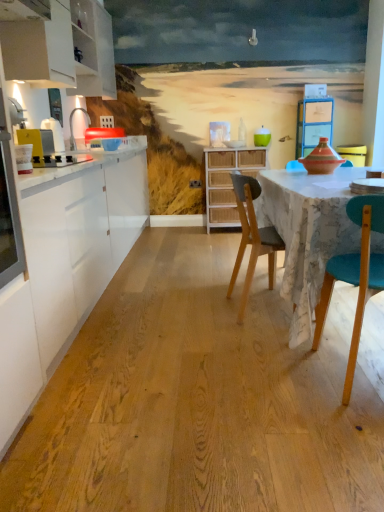
Find the location of a particular element. Image resolution: width=384 pixels, height=512 pixels. teal glossy bowl at upper center is located at coordinates (262, 137).

The image size is (384, 512). I want to click on wooden chair at center, so click(x=252, y=238).

What do you see at coordinates (38, 145) in the screenshot?
I see `metallic silver toaster at left` at bounding box center [38, 145].

Describe the element at coordinates (62, 52) in the screenshot. I see `white matte cabinet at upper left` at that location.

In order to click on white glossy countertop at left in this screenshot , I will do [64, 268].

Between white wicker cabinet at center and metallic silver toaster at left, which one appears on the right side from the viewer's perspective?

white wicker cabinet at center is more to the right.

From a real-world perspective, is white wicker cabinet at center on metallic silver toaster at left?

Incorrect, from a real-world perspective, white wicker cabinet at center is lower than metallic silver toaster at left.

From the image's perspective, between white wicker cabinet at center and metallic silver toaster at left, which one is located above?

metallic silver toaster at left is shown above in the image.

Is white wicker cabinet at center positioned with its back to metallic silver toaster at left?

That's not correct — white wicker cabinet at center is not looking away from metallic silver toaster at left.

Is teal glossy bowl at upper center smaller than metallic silver toaster at left?

Yes, teal glossy bowl at upper center is smaller than metallic silver toaster at left.

Between point (257, 141) and point (40, 156), which one is positioned behind?

Point (257, 141)

From the picture: Between teal glossy bowl at upper center and metallic silver toaster at left, which one has smaller width?

Thinner between the two is teal glossy bowl at upper center.

Is teal glossy bowl at upper center positioned with its back to metallic silver toaster at left?

teal glossy bowl at upper center does not have its back to metallic silver toaster at left.

From the image's perspective, does metallic silver toaster at left appear lower than white matte cabinet at upper left?

Yes.

How different are the orientations of metallic silver toaster at left and white matte cabinet at upper left in degrees?

1.33 degrees.

Is metallic silver toaster at left aimed at white matte cabinet at upper left?

No, metallic silver toaster at left is not aimed at white matte cabinet at upper left.

Considering the positions of objects metallic silver toaster at left and white matte cabinet at upper left in the image provided, who is behind, metallic silver toaster at left or white matte cabinet at upper left?

Positioned behind is metallic silver toaster at left.

Who is smaller, wooden chair at center or metallic silver toaster at left?

metallic silver toaster at left.

This screenshot has width=384, height=512. In order to click on chair on the right of metallic silver toaster at left in this screenshot , I will do `click(252, 238)`.

Is wooden chair at center completely or partially outside of metallic silver toaster at left?

Indeed, wooden chair at center is completely outside metallic silver toaster at left.

Considering the positions of objects wooden chair at center and metallic silver toaster at left in the image provided, who is behind, wooden chair at center or metallic silver toaster at left?

metallic silver toaster at left is behind.

Does white matte cabinet at upper left have a greater width compared to white glossy countertop at left?

No, white matte cabinet at upper left is not wider than white glossy countertop at left.

From a real-world perspective, which is physically below, white matte cabinet at upper left or white glossy countertop at left?

white glossy countertop at left is physically lower.

Is white glossy countertop at left at the back of white matte cabinet at upper left?

No, white glossy countertop at left is not at the back of white matte cabinet at upper left.

Can you confirm if wooden chair at center is smaller than white wicker cabinet at center?

Yes, wooden chair at center is smaller than white wicker cabinet at center.

Is wooden chair at center situated inside white wicker cabinet at center or outside?

wooden chair at center is outside white wicker cabinet at center.

In the scene shown: From a real-world perspective, is wooden chair at center positioned over white wicker cabinet at center based on gravity?

No, from a real-world perspective, wooden chair at center is not over white wicker cabinet at center

Image resolution: width=384 pixels, height=512 pixels. I want to click on chair below the white wicker cabinet at center (from a real-world perspective), so click(252, 238).

From a real-world perspective, is metallic silver toaster at left located higher than white wicker cabinet at center?

Yes, from a real-world perspective, metallic silver toaster at left is above white wicker cabinet at center.

Can you confirm if metallic silver toaster at left is shorter than white wicker cabinet at center?

Correct, metallic silver toaster at left is not as tall as white wicker cabinet at center.

Is metallic silver toaster at left aimed at white wicker cabinet at center?

No.

Find the location of a particular element. This screenshot has height=512, width=384. appliance above the white wicker cabinet at center (from a real-world perspective) is located at coordinates (38, 145).

Identify the location of appliance that appears below the teal glossy bowl at upper center (from the image's perspective). (38, 145).

Estimate the real-world distances between objects in this image. Which object is closer to metallic silver toaster at left, white wicker cabinet at center or white glossy countertop at left?

Among the two, white glossy countertop at left is located nearer to metallic silver toaster at left.

Estimate the real-world distances between objects in this image. Which object is closer to white matte cabinet at upper left, white glossy countertop at left or teal glossy bowl at upper center?

white glossy countertop at left is closer to white matte cabinet at upper left.

Considering their positions, is white wicker cabinet at center positioned closer to metallic silver toaster at left than wooden chair at center?

The object closer to metallic silver toaster at left is wooden chair at center.

Considering their positions, is white wicker cabinet at center positioned further to white matte cabinet at upper left than wooden chair at center?

wooden chair at center is positioned further to the anchor white matte cabinet at upper left.

From the image, which object appears to be nearer to teal glossy bowl at upper center, white matte cabinet at upper left or wooden chair at center?

white matte cabinet at upper left lies closer to teal glossy bowl at upper center than the other object.

Looking at the image, which one is located further to metallic silver toaster at left, white matte cabinet at upper left or white glossy countertop at left?

white matte cabinet at upper left.

Which object lies further to the anchor point white wicker cabinet at center, teal glossy bowl at upper center or wooden chair at center?

Among the two, wooden chair at center is located further to white wicker cabinet at center.

Which object lies nearer to the anchor point white matte cabinet at upper left, white wicker cabinet at center or white glossy countertop at left?

white glossy countertop at left lies closer to white matte cabinet at upper left than the other object.

Locate an element on the screen. This screenshot has width=384, height=512. appliance between wooden chair at center and teal glossy bowl at upper center from front to back is located at coordinates [x=38, y=145].

Where is `cupboard between white matte cabinet at upper left and teal glossy bowl at upper center from front to back`? The image size is (384, 512). cupboard between white matte cabinet at upper left and teal glossy bowl at upper center from front to back is located at coordinates (228, 181).

At what (x,y) coordinates should I click in order to perform the action: click on appliance located between white matte cabinet at upper left and teal glossy bowl at upper center in the depth direction. Please return your answer as a coordinate pair (x, y). Image resolution: width=384 pixels, height=512 pixels. Looking at the image, I should click on (38, 145).

Locate an element on the screen. This screenshot has width=384, height=512. appliance between wooden chair at center and white wicker cabinet at center in the front-back direction is located at coordinates (38, 145).